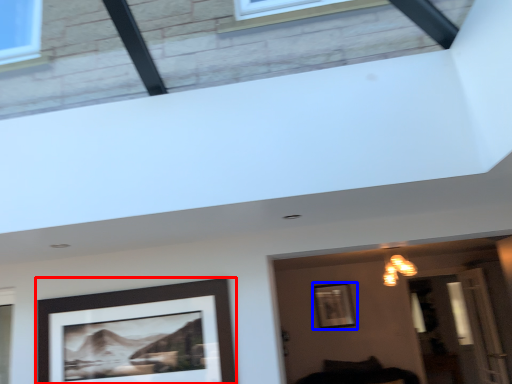
Question: Which point is further to the camera, picture frame (highlighted by a red box) or picture frame (highlighted by a blue box)?

Choices:
 (A) picture frame
 (B) picture frame

Answer: (B)